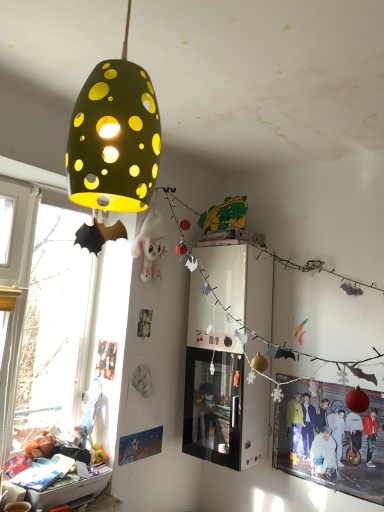
Question: In terms of size, does matte paper poster at lower left, which is counted as the second poster page, starting from the left, appear bigger or smaller than matte black poster at lower left, which is the 2th poster page from right to left?

Choices:
 (A) small
 (B) big

Answer: (B)

Question: In terms of width, does matte paper poster at lower left, the second poster page viewed from the top, look wider or thinner when compared to matte black poster at lower left, the 1th poster page from the top?

Choices:
 (A) wide
 (B) thin

Answer: (A)

Question: Which of these objects is positioned farthest from the matte paper poster at lower left, which is counted as the second poster page, starting from the left?

Choices:
 (A) matte black poster at lower left, which is the 2th poster page from right to left
 (B) matte green lampshade at upper left
 (C) red glossy poster at lower right

Answer: (B)

Question: Based on their relative distances, which object is nearer to the matte paper poster at lower left, positioned as the 1th poster page in bottom-to-top order?

Choices:
 (A) matte green lampshade at upper left
 (B) matte black poster at lower left, the 1th poster page from the top
 (C) red glossy poster at lower right

Answer: (B)